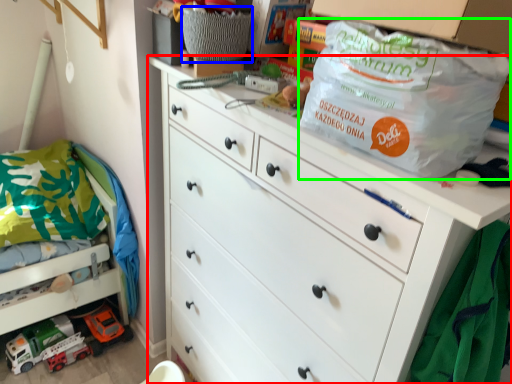
Question: Which is farther away from chest of drawers (highlighted by a red box)? basket (highlighted by a blue box) or bag (highlighted by a green box)?

Choices:
 (A) basket
 (B) bag

Answer: (A)